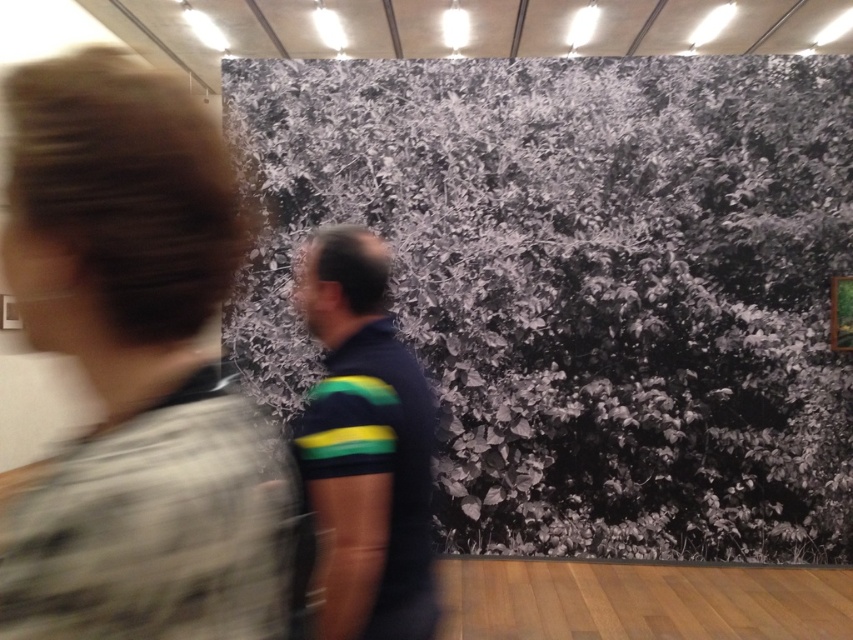
Question: Among these objects, which one is nearest to the camera?

Choices:
 (A) striped polo shirt at center
 (B) blurred hair at center

Answer: (B)

Question: Among these objects, which one is nearest to the camera?

Choices:
 (A) blurred hair at center
 (B) striped polo shirt at center

Answer: (A)

Question: Does blurred hair at center have a larger size compared to striped polo shirt at center?

Choices:
 (A) no
 (B) yes

Answer: (A)

Question: Is blurred hair at center further to the viewer compared to striped polo shirt at center?

Choices:
 (A) yes
 (B) no

Answer: (B)

Question: Is blurred hair at center to the right of striped polo shirt at center from the viewer's perspective?

Choices:
 (A) no
 (B) yes

Answer: (A)

Question: Among these points, which one is nearest to the camera?

Choices:
 (A) (115, 198)
 (B) (331, 616)

Answer: (A)